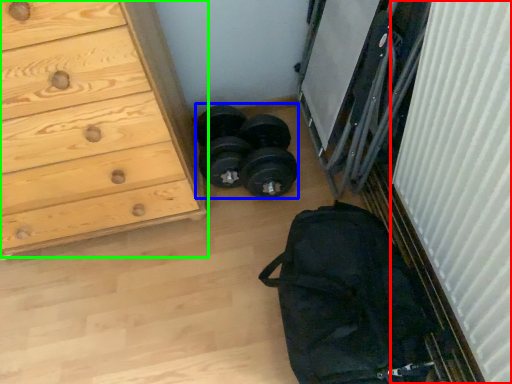
Question: Based on their relative distances, which object is nearer to curtain (highlighted by a red box)? Choose from reel (highlighted by a blue box) and chest of drawers (highlighted by a green box).

Choices:
 (A) reel
 (B) chest of drawers

Answer: (A)